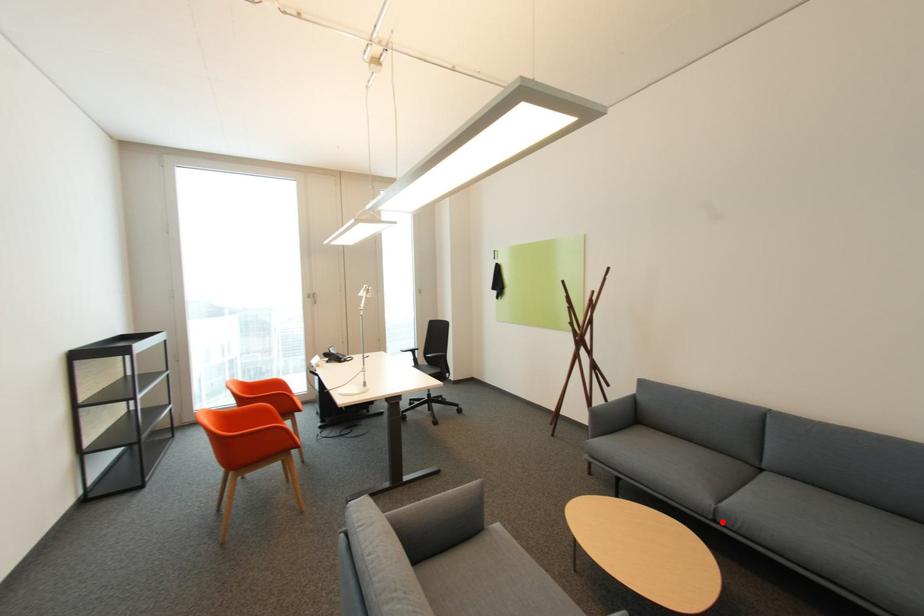
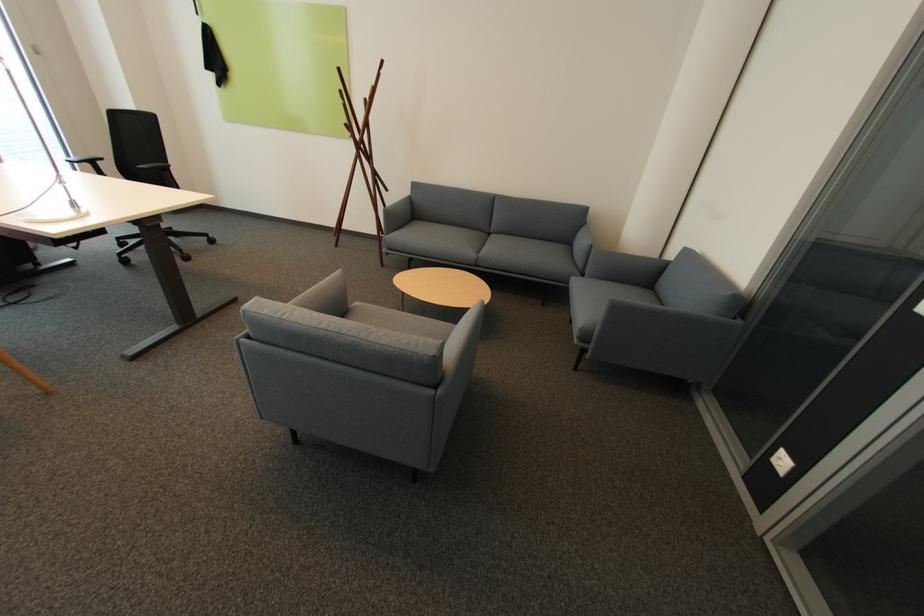
Where in the second image is the point corresponding to the highlighted location from the first image?

(482, 265)